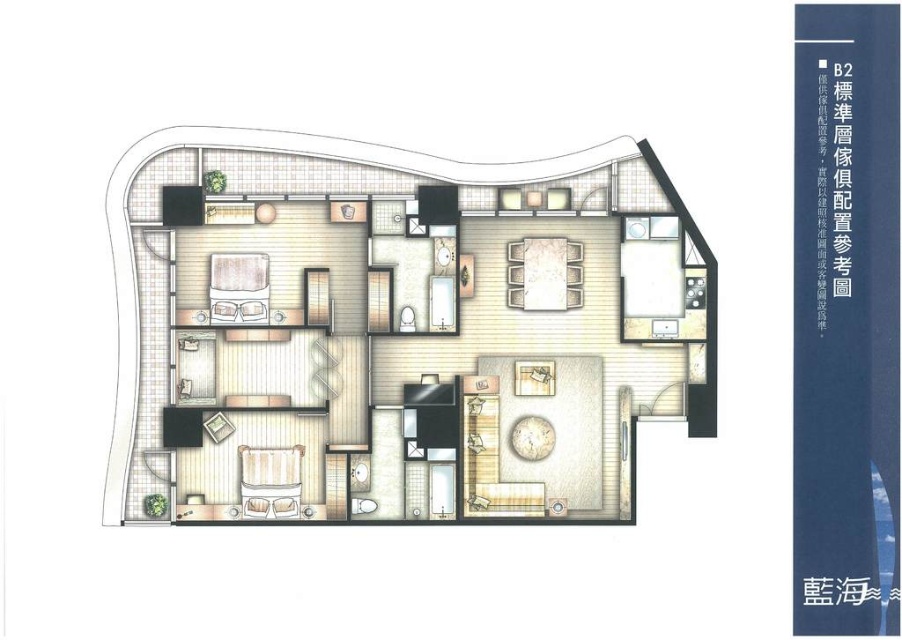
Is matte wood coffee table at center positioned behind striped fabric bed at center?

No, it is not.

Between point (133, 330) and point (299, 483), which one is positioned in front?

Point (133, 330)

Locate an element on the screen. matte wood coffee table at center is located at coordinates (401, 326).

Does point (245, 486) lie behind point (249, 308)?

No, (245, 486) is closer to viewer.

Is striped fabric bed at center bigger than matte white bed at center?

No, striped fabric bed at center is not bigger than matte white bed at center.

The image size is (902, 640). Find the location of `striped fabric bed at center`. striped fabric bed at center is located at coordinates (270, 481).

Image resolution: width=902 pixels, height=640 pixels. In order to click on striped fabric bed at center in this screenshot , I will do `click(270, 481)`.

Looking at this image, is matte wood coffee table at center smaller than matte white bed at center?

Incorrect, matte wood coffee table at center is not smaller in size than matte white bed at center.

Can you confirm if matte wood coffee table at center is thinner than matte white bed at center?

No.

Is point (397, 305) positioned behind point (250, 291)?

No, (397, 305) is closer to viewer.

Locate an element on the screen. The width and height of the screenshot is (902, 640). matte wood coffee table at center is located at coordinates (x=401, y=326).